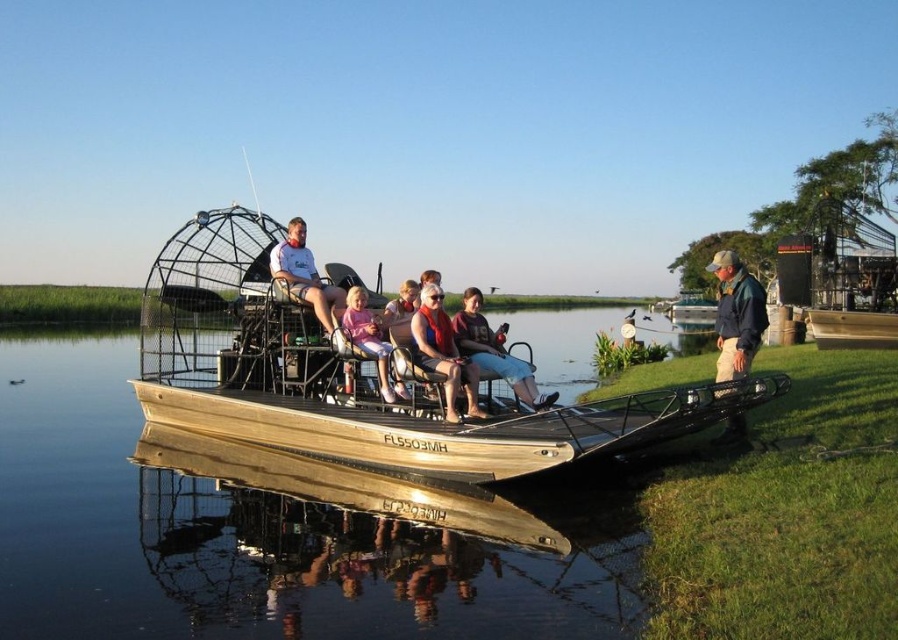
Is green fabric jacket at right thinner than pink fabric baby carriage at center?

Incorrect, green fabric jacket at right's width is not less than pink fabric baby carriage at center's.

The width and height of the screenshot is (898, 640). What do you see at coordinates (736, 316) in the screenshot? I see `green fabric jacket at right` at bounding box center [736, 316].

Where is `green fabric jacket at right`? The height and width of the screenshot is (640, 898). green fabric jacket at right is located at coordinates (736, 316).

Is green fabric jacket at right bigger than matte orange life vest at center?

Correct, green fabric jacket at right is larger in size than matte orange life vest at center.

Is point (751, 298) farther from viewer compared to point (449, 333)?

No, (751, 298) is in front of (449, 333).

This screenshot has height=640, width=898. Find the location of `green fabric jacket at right`. green fabric jacket at right is located at coordinates click(736, 316).

This screenshot has height=640, width=898. What do you see at coordinates (736, 316) in the screenshot? I see `green fabric jacket at right` at bounding box center [736, 316].

Is green fabric jacket at right closer to camera compared to matte pink shirt at center?

Yes, it is in front of matte pink shirt at center.

Is point (729, 324) less distant than point (389, 310)?

Yes, it is in front of point (389, 310).

Locate an element on the screen. This screenshot has width=898, height=640. green fabric jacket at right is located at coordinates (736, 316).